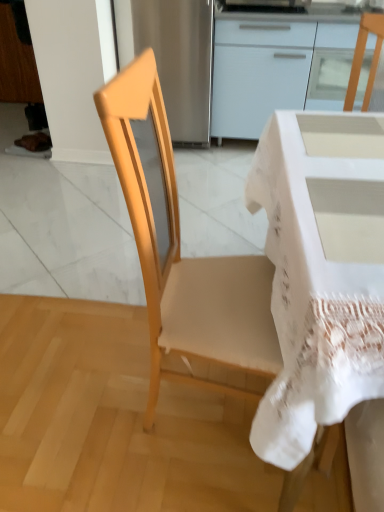
Question: Is white glossy cabinet at upper center spatially inside white lace-covered desk at center, or outside of it?

Choices:
 (A) inside
 (B) outside

Answer: (B)

Question: From the image's perspective, is white glossy cabinet at upper center located above or below white lace-covered desk at center?

Choices:
 (A) above
 (B) below

Answer: (A)

Question: Estimate the real-world distances between objects in this image. Which object is closer to the white lace-covered desk at center?

Choices:
 (A) light wood chair at center
 (B) white glossy cabinet at upper center

Answer: (A)

Question: Estimate the real-world distances between objects in this image. Which object is closer to the white lace-covered desk at center?

Choices:
 (A) light wood chair at center
 (B) white glossy cabinet at upper center

Answer: (A)